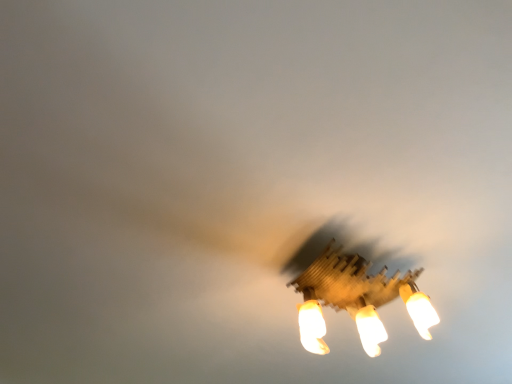
Describe the element at coordinates (356, 298) in the screenshot. Image resolution: width=512 pixels, height=384 pixels. I see `wooden lampshade at lower right` at that location.

Based on the photo, measure the distance between point (360,272) and camera.

The depth of point (360,272) is 1.33 meters.

In order to click on wooden lampshade at lower right in this screenshot , I will do `click(356, 298)`.

This screenshot has height=384, width=512. I want to click on wooden lampshade at lower right, so click(356, 298).